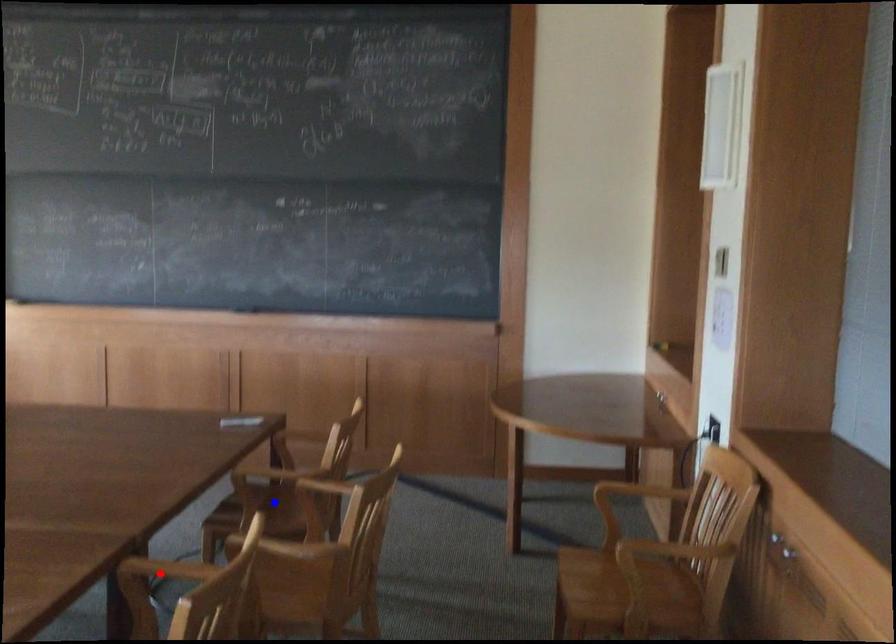
Question: Which of the two points in the image is closer to the camera?

Choices:
 (A) Blue point is closer.
 (B) Red point is closer.

Answer: (B)